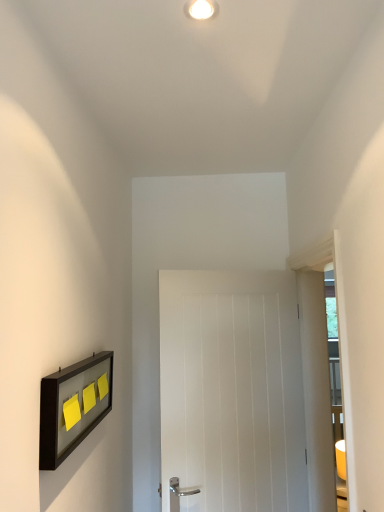
Question: Considering the relative sizes of matte black picture frame at left and transparent glass door at right in the image provided, is matte black picture frame at left wider than transparent glass door at right?

Choices:
 (A) no
 (B) yes

Answer: (A)

Question: Is matte black picture frame at left completely or partially outside of transparent glass door at right?

Choices:
 (A) no
 (B) yes

Answer: (B)

Question: From the image's perspective, is matte black picture frame at left below transparent glass door at right?

Choices:
 (A) no
 (B) yes

Answer: (A)

Question: Is matte black picture frame at left facing towards transparent glass door at right?

Choices:
 (A) yes
 (B) no

Answer: (A)

Question: Is matte black picture frame at left thinner than transparent glass door at right?

Choices:
 (A) no
 (B) yes

Answer: (B)

Question: Is the depth of matte black picture frame at left greater than that of transparent glass door at right?

Choices:
 (A) no
 (B) yes

Answer: (A)

Question: Is there a large distance between white wooden door at center and transparent glass door at right?

Choices:
 (A) no
 (B) yes

Answer: (A)

Question: Does white wooden door at center have a larger size compared to transparent glass door at right?

Choices:
 (A) no
 (B) yes

Answer: (A)

Question: From the image's perspective, is white wooden door at center on top of transparent glass door at right?

Choices:
 (A) no
 (B) yes

Answer: (A)

Question: Is the position of white wooden door at center less distant than that of transparent glass door at right?

Choices:
 (A) yes
 (B) no

Answer: (B)

Question: Is white wooden door at center thinner than transparent glass door at right?

Choices:
 (A) yes
 (B) no

Answer: (A)

Question: Is transparent glass door at right a part of white wooden door at center?

Choices:
 (A) no
 (B) yes

Answer: (A)

Question: From a real-world perspective, is white wooden door at center physically below white glossy light fixture at upper center?

Choices:
 (A) no
 (B) yes

Answer: (B)